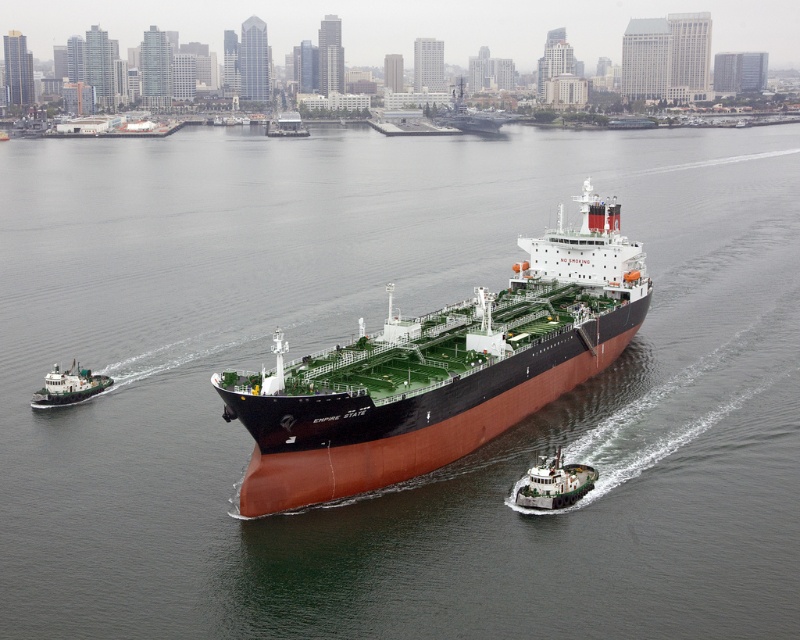
Does rustic brown ship at center have a smaller size compared to rustic metal barge at center?

Incorrect, rustic brown ship at center is not smaller in size than rustic metal barge at center.

Is rustic brown ship at center to the left of rustic metal barge at center from the viewer's perspective?

In fact, rustic brown ship at center is to the right of rustic metal barge at center.

The image size is (800, 640). I want to click on rustic brown ship at center, so click(x=440, y=371).

Can you confirm if green matte tugboat at lower right is positioned to the left of rustic metal barge at center?

No, green matte tugboat at lower right is not to the left of rustic metal barge at center.

Between green matte tugboat at lower right and rustic metal barge at center, which one has less height?

green matte tugboat at lower right

Where is `green matte tugboat at lower right`? green matte tugboat at lower right is located at coordinates (556, 483).

Does rustic brown ship at center appear under green matte tugboat at lower left?

No, rustic brown ship at center is not below green matte tugboat at lower left.

Does point (270, 381) come behind point (46, 396)?

No, it is in front of (46, 396).

Locate an element on the screen. rustic brown ship at center is located at coordinates (440, 371).